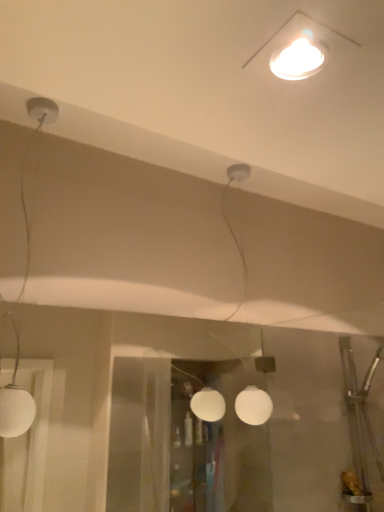
Question: Is white glossy light fixture at upper center, the 1th lamp from the front, shorter than white matte globe at center, which is the 1th lamp from back to front?

Choices:
 (A) yes
 (B) no

Answer: (A)

Question: Is white glossy light fixture at upper center, the 1th lamp from the front, completely or partially outside of white matte globe at center, which is the 3th lamp from front to back?

Choices:
 (A) no
 (B) yes

Answer: (B)

Question: Considering the relative sizes of white glossy light fixture at upper center, which appears as the third lamp when viewed from the left, and white matte globe at center, which is the 1th lamp from back to front, in the image provided, is white glossy light fixture at upper center, which appears as the third lamp when viewed from the left, bigger than white matte globe at center, which is the 1th lamp from back to front,?

Choices:
 (A) yes
 (B) no

Answer: (B)

Question: Is white glossy light fixture at upper center, the 3th lamp viewed from the back, surrounding white matte globe at center, the 2th lamp from the left?

Choices:
 (A) yes
 (B) no

Answer: (B)

Question: From a real-world perspective, is white glossy light fixture at upper center, the 1th lamp from the front, positioned under white matte globe at center, which is the 1th lamp from back to front, based on gravity?

Choices:
 (A) no
 (B) yes

Answer: (A)

Question: From a real-world perspective, relative to white matte globe at center, which appears as the 2th lamp when viewed from the right, is white glossy light fixture at upper center, marked as the first lamp in a right-to-left arrangement, vertically above or below?

Choices:
 (A) above
 (B) below

Answer: (A)

Question: Is white glossy light fixture at upper center, marked as the first lamp in a right-to-left arrangement, bigger or smaller than white matte globe at center, the 2th lamp from the left?

Choices:
 (A) small
 (B) big

Answer: (A)

Question: From the image's perspective, is white glossy light fixture at upper center, which appears as the third lamp when viewed from the left, positioned above or below white matte globe at center, which appears as the 2th lamp when viewed from the right?

Choices:
 (A) above
 (B) below

Answer: (A)

Question: Is white glossy light fixture at upper center, marked as the first lamp in a right-to-left arrangement, inside or outside of white matte globe at center, which is the 3th lamp from front to back?

Choices:
 (A) inside
 (B) outside

Answer: (B)

Question: Which is correct: white matte globe at center, which is the 3th lamp from front to back, is inside white matte globe lamp at left, which is counted as the second lamp, starting from the front, or outside of it?

Choices:
 (A) outside
 (B) inside

Answer: (A)

Question: In the image, is white matte globe at center, which appears as the 2th lamp when viewed from the right, positioned in front of or behind white matte globe lamp at left, which ranks as the 1th lamp in left-to-right order?

Choices:
 (A) front
 (B) behind

Answer: (B)

Question: Considering the relative positions of white matte globe at center, the 2th lamp from the left, and white matte globe lamp at left, which is counted as the second lamp, starting from the front, in the image provided, is white matte globe at center, the 2th lamp from the left, to the left or to the right of white matte globe lamp at left, which is counted as the second lamp, starting from the front,?

Choices:
 (A) right
 (B) left

Answer: (A)

Question: Looking at the image, does white matte globe at center, which is the 3th lamp from front to back, seem bigger or smaller compared to white matte globe lamp at left, the third lamp from the right?

Choices:
 (A) small
 (B) big

Answer: (B)

Question: Is point (218, 396) closer or farther from the camera than point (296, 51)?

Choices:
 (A) closer
 (B) farther

Answer: (B)

Question: From their relative heights in the image, would you say white matte globe at center, which is the 3th lamp from front to back, is taller or shorter than white glossy light fixture at upper center, the 1th lamp from the front?

Choices:
 (A) tall
 (B) short

Answer: (A)